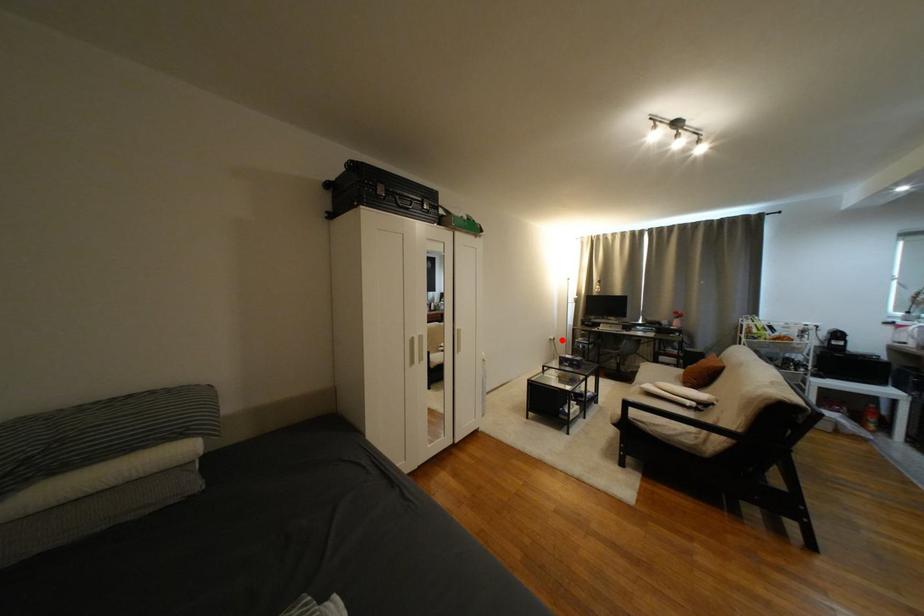
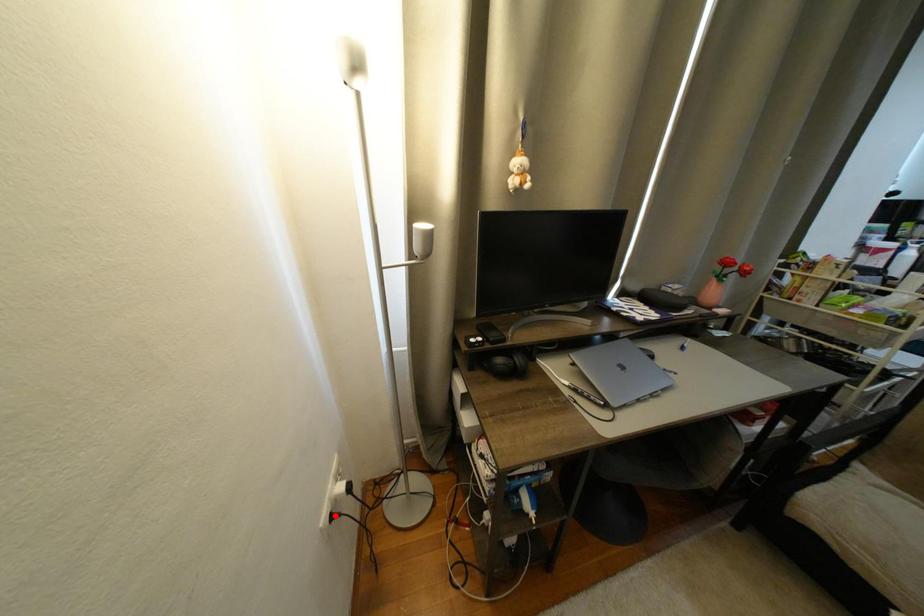
I am providing you with two images of the same scene from different viewpoints. A red point is marked on the first image and another point is marked on the second image. Is the marked point in image1 the same physical position as the marked point in image2?

No